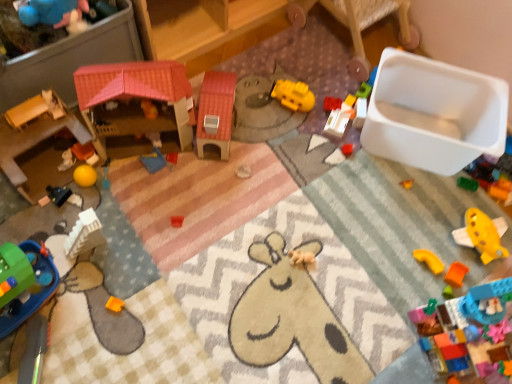
At what (x,y) coordinates should I click in order to perform the action: click on vacant area that is situated to the right of plastic pink house at center, positioned as the 9th toy in right-to-left order. Please return your answer as a coordinate pair (x, y). Looking at the image, I should click on (263, 154).